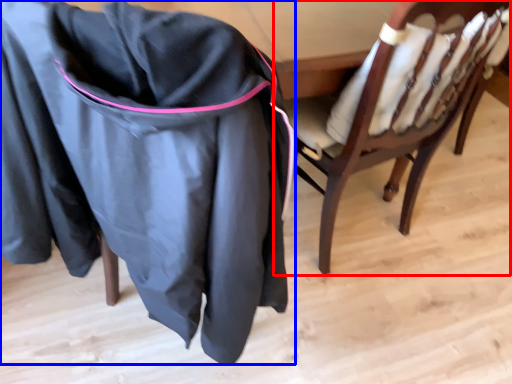
Question: Which object is closer to the camera taking this photo, chair (highlighted by a red box) or clothing (highlighted by a blue box)?

Choices:
 (A) chair
 (B) clothing

Answer: (B)